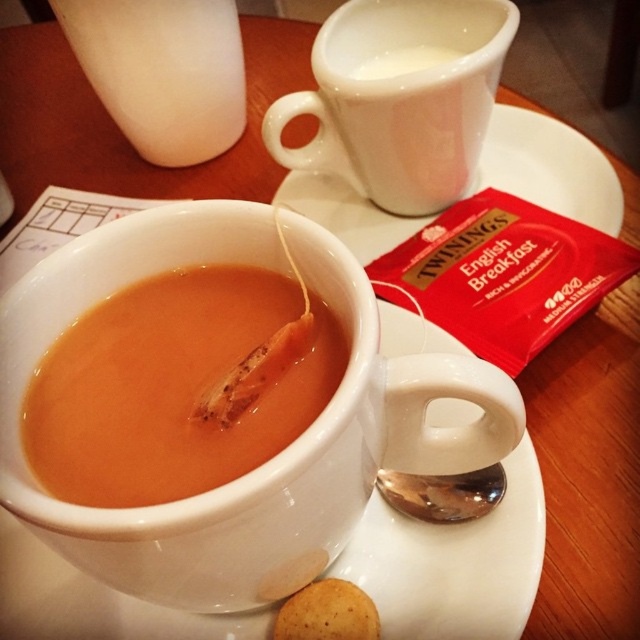
Consider the image. Measure the distance between point (305, 96) and camera.

Point (305, 96) is 27.22 inches away from camera.

From the picture: Is white glossy mug at upper center to the left of white ceramic saucer at upper center from the viewer's perspective?

Indeed, white glossy mug at upper center is positioned on the left side of white ceramic saucer at upper center.

Does point (449, 83) lie behind point (401, 218)?

No, it is not.

Where is `white glossy mug at upper center`? The height and width of the screenshot is (640, 640). white glossy mug at upper center is located at coordinates (400, 99).

Does white matte milk container at upper left appear under silver/metallic spoon at lower center?

Incorrect, white matte milk container at upper left is not positioned below silver/metallic spoon at lower center.

The height and width of the screenshot is (640, 640). What do you see at coordinates (163, 72) in the screenshot?
I see `white matte milk container at upper left` at bounding box center [163, 72].

The image size is (640, 640). Identify the location of white matte milk container at upper left. (163, 72).

Is white glossy mug at upper center positioned at the back of silver/metallic spoon at lower center?

That is True.

Which is more to the right, white glossy mug at upper center or silver/metallic spoon at lower center?

silver/metallic spoon at lower center

Between point (422, 45) and point (442, 480), which one is positioned in front?

Point (442, 480) is in front.

Locate an element on the screen. The image size is (640, 640). white glossy mug at upper center is located at coordinates (400, 99).